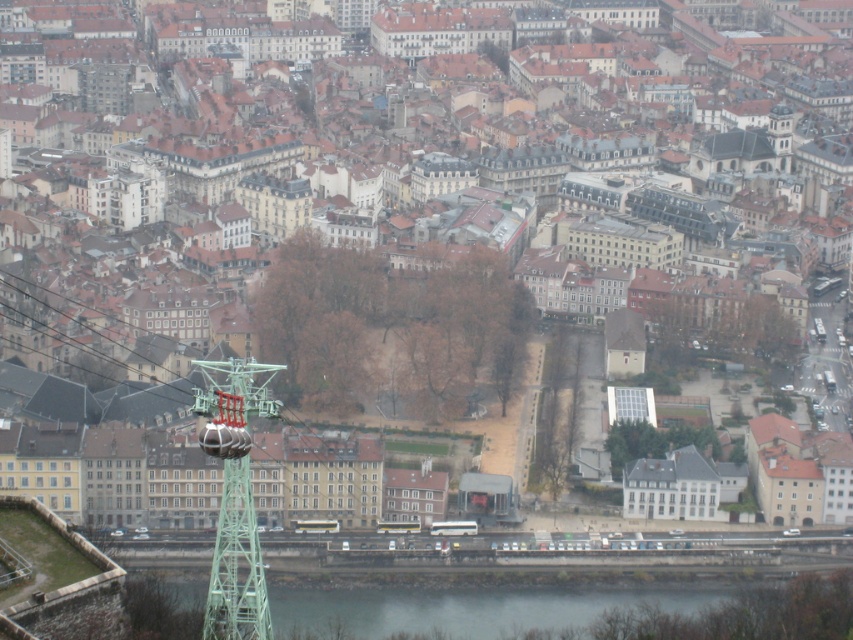
Question: Does gray concrete river at lower center appear on the right side of green metallic cable car tower at left?

Choices:
 (A) no
 (B) yes

Answer: (B)

Question: Does gray concrete river at lower center appear on the left side of green metallic cable car tower at left?

Choices:
 (A) yes
 (B) no

Answer: (B)

Question: Is gray concrete river at lower center positioned in front of green metallic cable car tower at left?

Choices:
 (A) yes
 (B) no

Answer: (B)